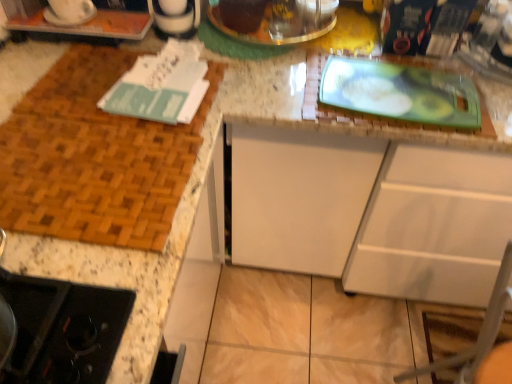
Question: Can you confirm if white matte cabinet at center is thinner than white glossy coffee maker at upper left, placed as the first appliance when sorted from front to back?

Choices:
 (A) yes
 (B) no

Answer: (B)

Question: Would you consider white matte cabinet at center to be distant from white glossy coffee maker at upper left, acting as the 1th appliance starting from the left?

Choices:
 (A) no
 (B) yes

Answer: (A)

Question: Can you confirm if white matte cabinet at center is wider than white glossy coffee maker at upper left, the 2th appliance positioned from the right?

Choices:
 (A) no
 (B) yes

Answer: (B)

Question: Does white matte cabinet at center have a lesser height compared to white glossy coffee maker at upper left, acting as the 1th appliance starting from the left?

Choices:
 (A) yes
 (B) no

Answer: (B)

Question: Does white matte cabinet at center contain white glossy coffee maker at upper left, placed as the first appliance when sorted from front to back?

Choices:
 (A) yes
 (B) no

Answer: (B)

Question: In the image, is metallic silver pot at upper center, placed as the 1th appliance when sorted from back to front, on the left side or the right side of white glossy coffee maker at upper left, acting as the 1th appliance starting from the left?

Choices:
 (A) right
 (B) left

Answer: (A)

Question: In the image, is metallic silver pot at upper center, placed as the 1th appliance when sorted from back to front, positioned in front of or behind white glossy coffee maker at upper left, acting as the 1th appliance starting from the left?

Choices:
 (A) behind
 (B) front

Answer: (A)

Question: From the image's perspective, is metallic silver pot at upper center, the 1th appliance in the right-to-left sequence, above or below white glossy coffee maker at upper left, placed as the first appliance when sorted from front to back?

Choices:
 (A) above
 (B) below

Answer: (A)

Question: From a real-world perspective, relative to white glossy coffee maker at upper left, placed as the first appliance when sorted from front to back, is metallic silver pot at upper center, arranged as the second appliance when viewed from the left, vertically above or below?

Choices:
 (A) above
 (B) below

Answer: (B)

Question: In terms of height, does metallic silver pot at upper center, which appears as the 2th appliance when viewed from the front, look taller or shorter compared to white matte cabinet at center?

Choices:
 (A) tall
 (B) short

Answer: (B)

Question: In the image, is metallic silver pot at upper center, the 1th appliance in the right-to-left sequence, on the left side or the right side of white matte cabinet at center?

Choices:
 (A) left
 (B) right

Answer: (A)

Question: Is metallic silver pot at upper center, arranged as the second appliance when viewed from the left, spatially inside white matte cabinet at center, or outside of it?

Choices:
 (A) outside
 (B) inside

Answer: (A)

Question: In the image, is metallic silver pot at upper center, which appears as the 2th appliance when viewed from the front, positioned in front of or behind white matte cabinet at center?

Choices:
 (A) front
 (B) behind

Answer: (B)

Question: In terms of height, does white matte cabinet at center look taller or shorter compared to white glossy coffee maker at upper left, placed as the 2th appliance when sorted from back to front?

Choices:
 (A) tall
 (B) short

Answer: (A)

Question: Based on their sizes in the image, would you say white matte cabinet at center is bigger or smaller than white glossy coffee maker at upper left, the 2th appliance positioned from the right?

Choices:
 (A) big
 (B) small

Answer: (A)